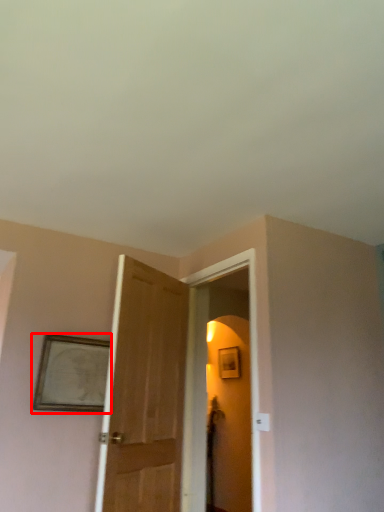
Question: Where is picture frame (annotated by the red box) located in relation to screen door in the image?

Choices:
 (A) left
 (B) right

Answer: (A)